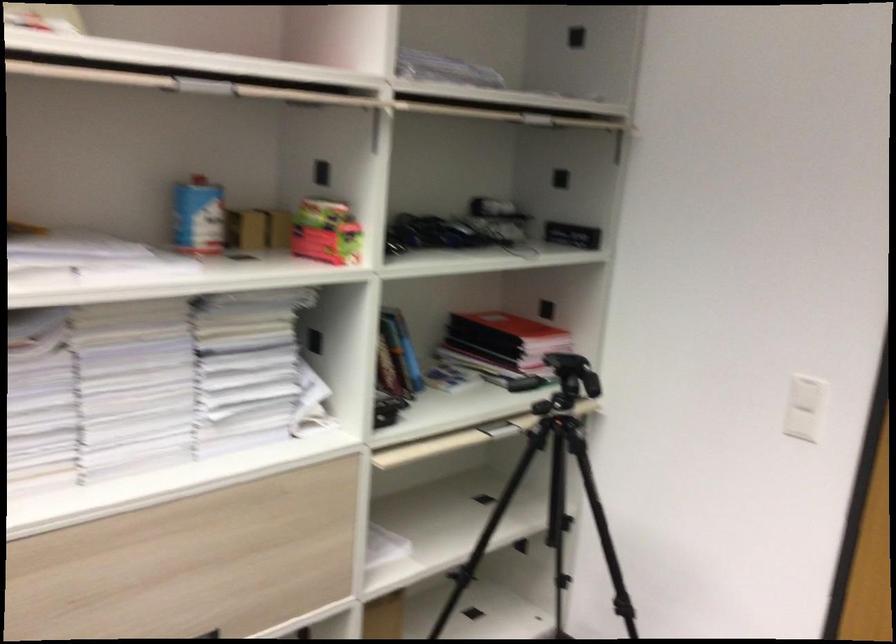
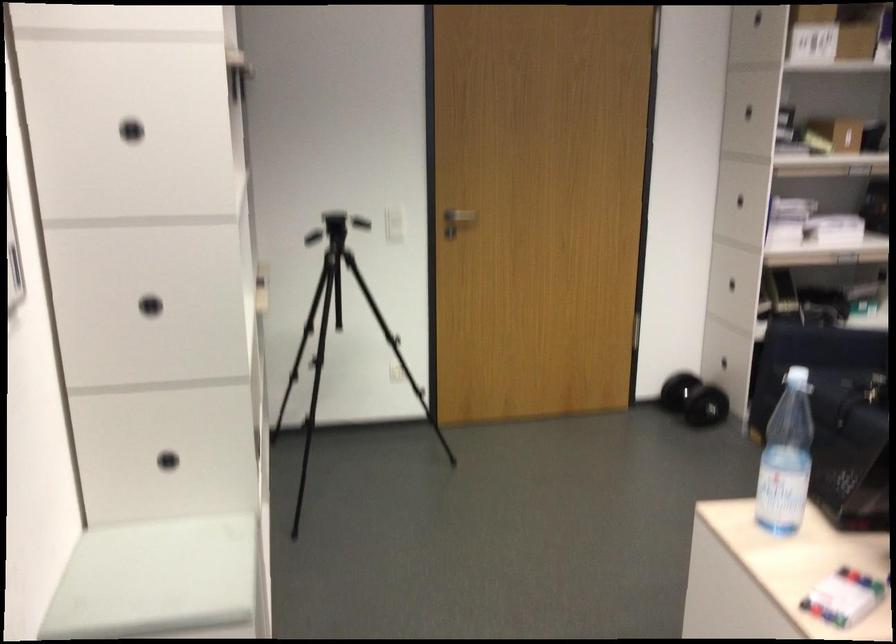
Where in the second image is the point corresponding to (x=710, y=570) from the first image?

(339, 334)